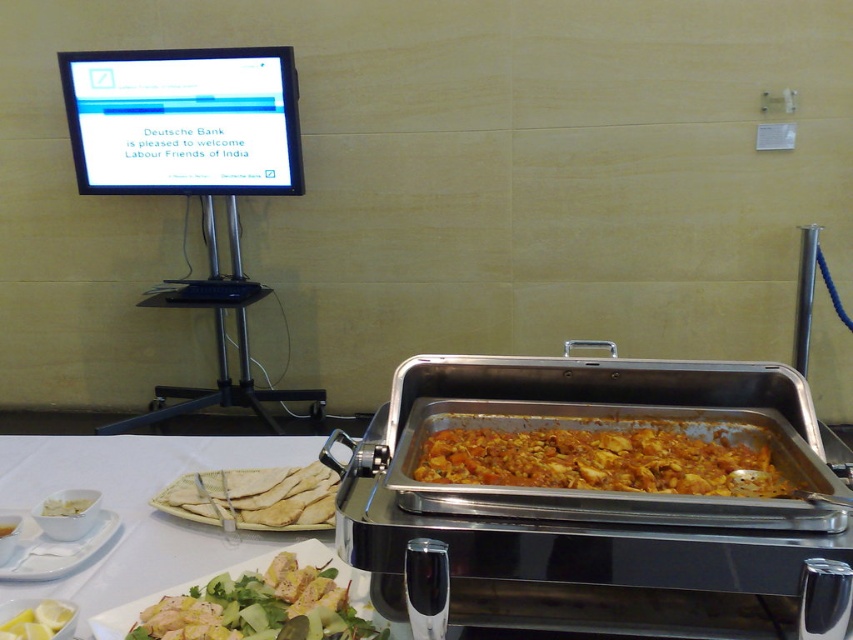
In the scene shown: You are a guest at the buffet and want to grab both the yellow matte lemon at lower left and the white matte bowl at lower left. Since you can only reach one at a time, which one should you pick up first to make it easier to reach the other?

You should pick up the white matte bowl at lower left first because the yellow matte lemon at lower left is to the right of it, so once you move the bowl out of the way, you can easily reach the lemon to the right.

You are at a buffet and want to grab both the yellow matte lemon at lower left and the white matte bowl at lower left. If you can only reach 10 inches, can you pick both items without moving your hand?

The yellow matte lemon at lower left is 10.88 inches away from the white matte bowl at lower left. Since your reach is only 10 inches, you cannot pick both items without moving your hand.